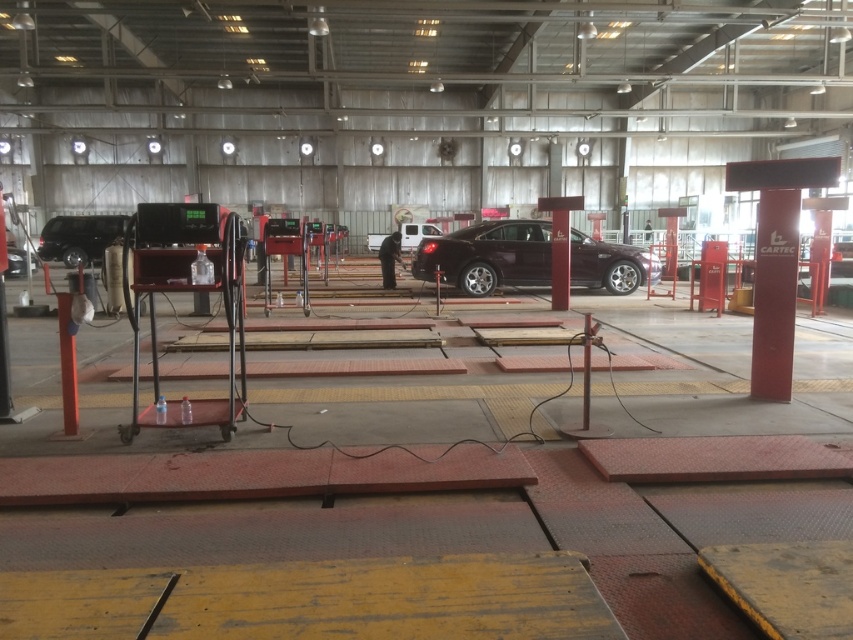
Is shiny black car at left below white matte van at center?

Correct, shiny black car at left is located below white matte van at center.

Measure the distance between shiny black car at left and camera.

They are 20.36 meters apart.

What do you see at coordinates (79, 237) in the screenshot? This screenshot has width=853, height=640. I see `shiny black car at left` at bounding box center [79, 237].

At what (x,y) coordinates should I click in order to perform the action: click on shiny black car at left. Please return your answer as a coordinate pair (x, y). Looking at the image, I should click on (79, 237).

Does satin burgundy car at center have a smaller size compared to white matte van at center?

Incorrect, satin burgundy car at center is not smaller in size than white matte van at center.

Locate an element on the screen. This screenshot has width=853, height=640. satin burgundy car at center is located at coordinates (488, 256).

Which is in front, point (521, 244) or point (409, 244)?

Point (521, 244)

The height and width of the screenshot is (640, 853). What are the coordinates of `satin burgundy car at center` in the screenshot? It's located at (488, 256).

Does satin burgundy car at center appear under shiny black car at left?

Yes.

Is satin burgundy car at center taller than shiny black car at left?

Incorrect, satin burgundy car at center's height is not larger of shiny black car at left's.

Describe the element at coordinates (488, 256) in the screenshot. I see `satin burgundy car at center` at that location.

Find the location of a particular element. satin burgundy car at center is located at coordinates (488, 256).